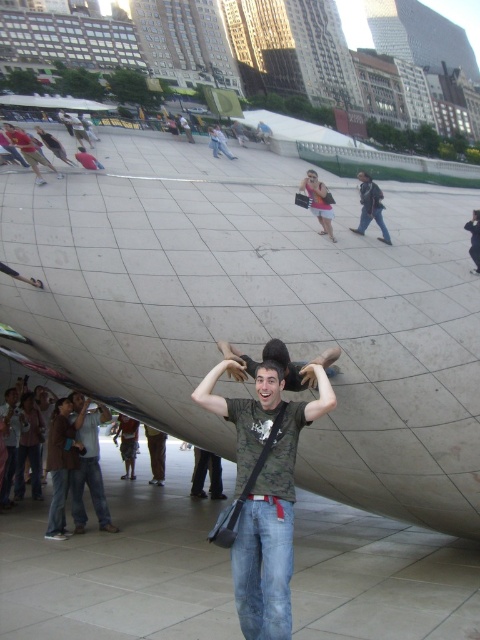
Question: Where is dark green t-shirt at center located in relation to denim jeans at lower left in the image?

Choices:
 (A) above
 (B) below

Answer: (A)

Question: Based on their relative distances, which object is nearer to the pink fabric skirt at center?

Choices:
 (A) dark green t-shirt at center
 (B) denim jeans at lower left

Answer: (A)

Question: Which of the following is the farthest from the observer?

Choices:
 (A) dark green t-shirt at center
 (B) pink fabric skirt at center
 (C) denim jeans at lower left

Answer: (C)

Question: Among these objects, which one is farthest from the camera?

Choices:
 (A) denim jeans at lower left
 (B) dark green t-shirt at center
 (C) pink fabric skirt at center

Answer: (A)

Question: Can you confirm if dark green t-shirt at center is wider than denim jeans at lower left?

Choices:
 (A) no
 (B) yes

Answer: (B)

Question: Can you confirm if dark green t-shirt at center is positioned to the left of pink fabric skirt at center?

Choices:
 (A) no
 (B) yes

Answer: (B)